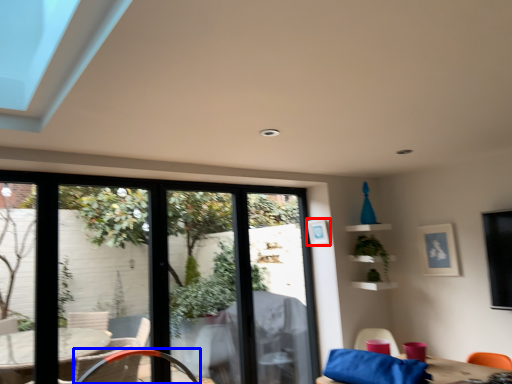
Question: Which object is further to the camera taking this photo, picture frame (highlighted by a red box) or chair (highlighted by a blue box)?

Choices:
 (A) picture frame
 (B) chair

Answer: (A)